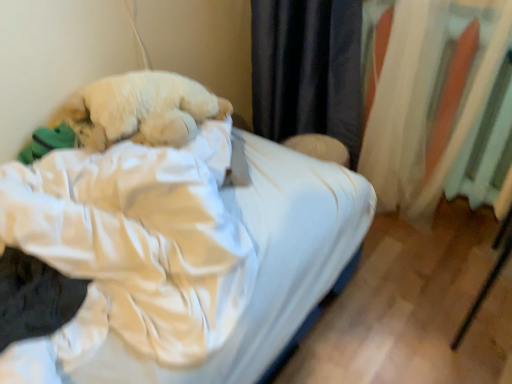
Question: Does white satin bed at center have a greater width compared to fluffy white dog at center?

Choices:
 (A) yes
 (B) no

Answer: (A)

Question: Can you confirm if white satin bed at center is taller than fluffy white dog at center?

Choices:
 (A) yes
 (B) no

Answer: (A)

Question: Can you confirm if white satin bed at center is smaller than fluffy white dog at center?

Choices:
 (A) no
 (B) yes

Answer: (A)

Question: Could you tell me if white satin bed at center is turned towards fluffy white dog at center?

Choices:
 (A) yes
 (B) no

Answer: (B)

Question: Is white satin bed at center outside fluffy white dog at center?

Choices:
 (A) yes
 (B) no

Answer: (A)

Question: From the image's perspective, does white satin bed at center appear higher than fluffy white dog at center?

Choices:
 (A) no
 (B) yes

Answer: (A)

Question: Is fluffy white dog at center looking in the opposite direction of white fabric curtain at right?

Choices:
 (A) yes
 (B) no

Answer: (B)

Question: Considering the relative positions of fluffy white dog at center and white fabric curtain at right in the image provided, is fluffy white dog at center to the right of white fabric curtain at right from the viewer's perspective?

Choices:
 (A) no
 (B) yes

Answer: (A)

Question: Is fluffy white dog at center located outside white fabric curtain at right?

Choices:
 (A) no
 (B) yes

Answer: (B)

Question: Can you confirm if fluffy white dog at center is positioned to the left of white fabric curtain at right?

Choices:
 (A) yes
 (B) no

Answer: (A)

Question: Is fluffy white dog at center thinner than white fabric curtain at right?

Choices:
 (A) yes
 (B) no

Answer: (B)

Question: Does fluffy white dog at center have a lesser height compared to white fabric curtain at right?

Choices:
 (A) yes
 (B) no

Answer: (A)

Question: Does fluffy white dog at center have a lesser height compared to white satin bed at center?

Choices:
 (A) no
 (B) yes

Answer: (B)